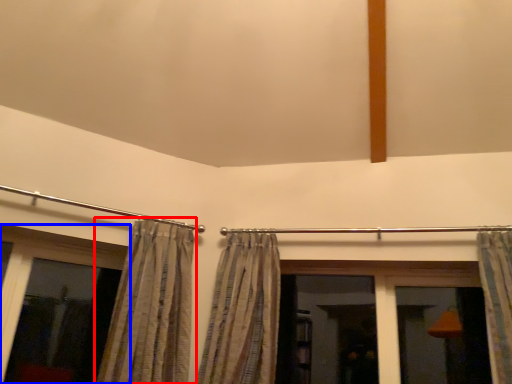
Question: Which point is closer to the camera, curtain (highlighted by a red box) or window (highlighted by a blue box)?

Choices:
 (A) curtain
 (B) window

Answer: (A)